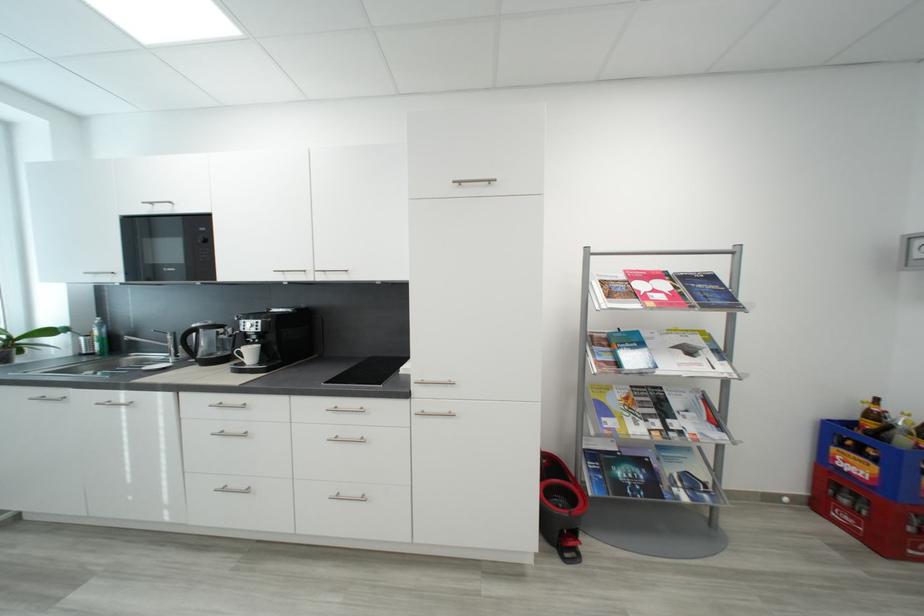
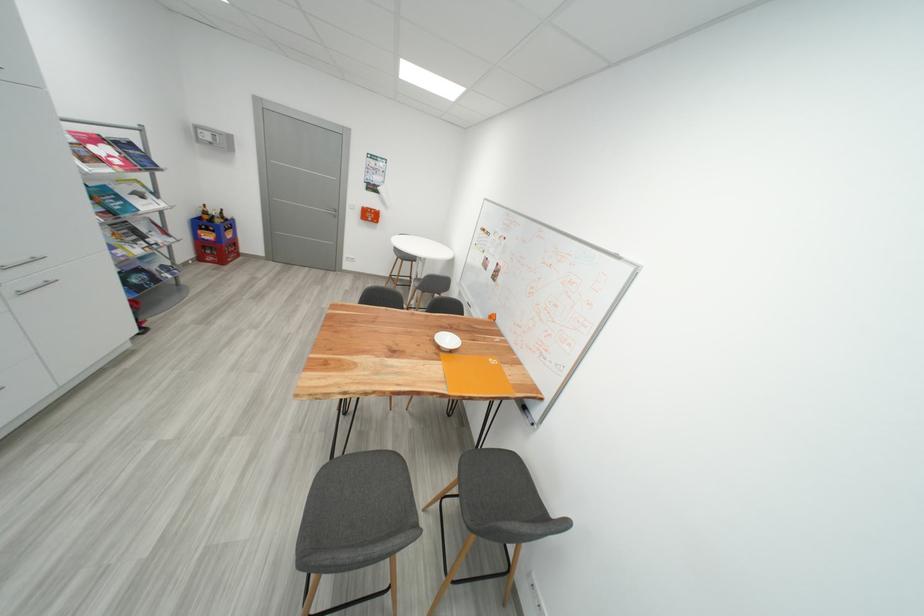
Where in the second image is the point corresponding to the point at 857,426 from the first image?

(208, 220)